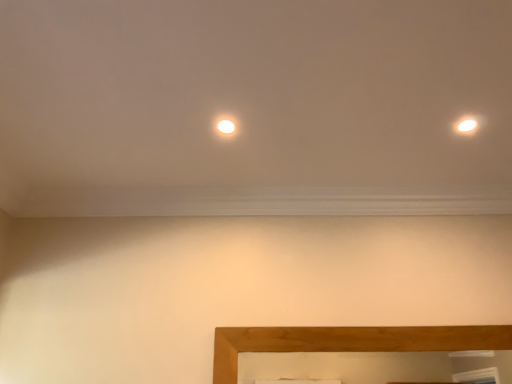
Question: Can you see matte white light at center touching white glossy light at upper right?

Choices:
 (A) yes
 (B) no

Answer: (B)

Question: From the image's perspective, is matte white light at center under white glossy light at upper right?

Choices:
 (A) yes
 (B) no

Answer: (B)

Question: Is the position of matte white light at center more distant than that of white glossy light at upper right?

Choices:
 (A) yes
 (B) no

Answer: (A)

Question: Can you confirm if matte white light at center is smaller than white glossy light at upper right?

Choices:
 (A) yes
 (B) no

Answer: (A)

Question: Is matte white light at center to the left of white glossy light at upper right from the viewer's perspective?

Choices:
 (A) yes
 (B) no

Answer: (A)

Question: Is matte white light at center located outside white glossy light at upper right?

Choices:
 (A) yes
 (B) no

Answer: (A)

Question: Can you confirm if white glossy light at upper right is shorter than matte white light at center?

Choices:
 (A) yes
 (B) no

Answer: (B)

Question: Does white glossy light at upper right appear on the right side of matte white light at center?

Choices:
 (A) no
 (B) yes

Answer: (B)

Question: Considering the relative sizes of white glossy light at upper right and matte white light at center in the image provided, is white glossy light at upper right bigger than matte white light at center?

Choices:
 (A) no
 (B) yes

Answer: (B)

Question: From a real-world perspective, is white glossy light at upper right below matte white light at center?

Choices:
 (A) yes
 (B) no

Answer: (A)

Question: Does white glossy light at upper right have a lesser width compared to matte white light at center?

Choices:
 (A) yes
 (B) no

Answer: (B)

Question: Is white glossy light at upper right further to camera compared to matte white light at center?

Choices:
 (A) yes
 (B) no

Answer: (B)

Question: Can you confirm if wooden picture frame at lower center is taller than white glossy light at upper right?

Choices:
 (A) yes
 (B) no

Answer: (A)